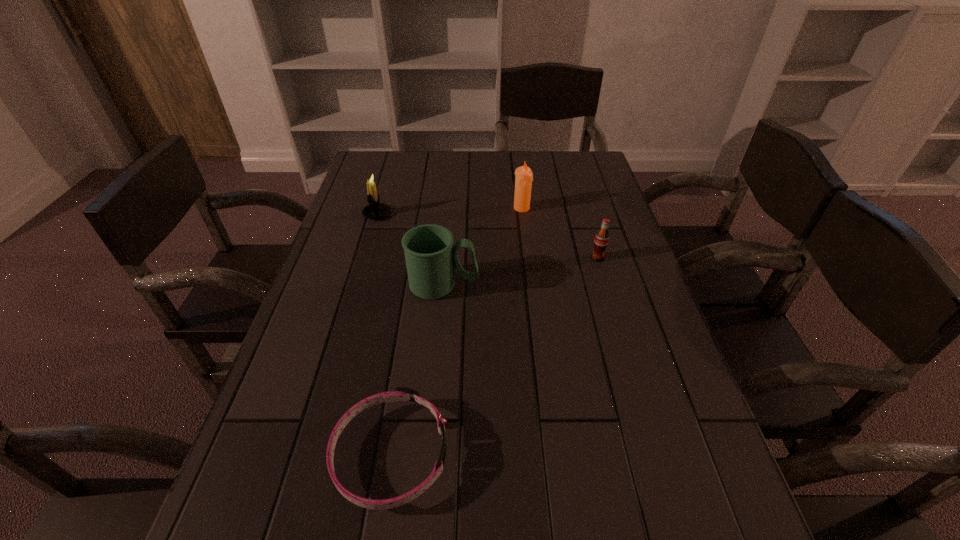
Where is `vacant space that satisfies the following two spatial constraints: 1. on the front side of the soda; 2. on the side of the mug with the handle`? Image resolution: width=960 pixels, height=540 pixels. vacant space that satisfies the following two spatial constraints: 1. on the front side of the soda; 2. on the side of the mug with the handle is located at coordinates (606, 285).

Locate an element on the screen. The image size is (960, 540). free location that satisfies the following two spatial constraints: 1. on the front side of the rightmost object; 2. on the left side of the candle is located at coordinates (528, 258).